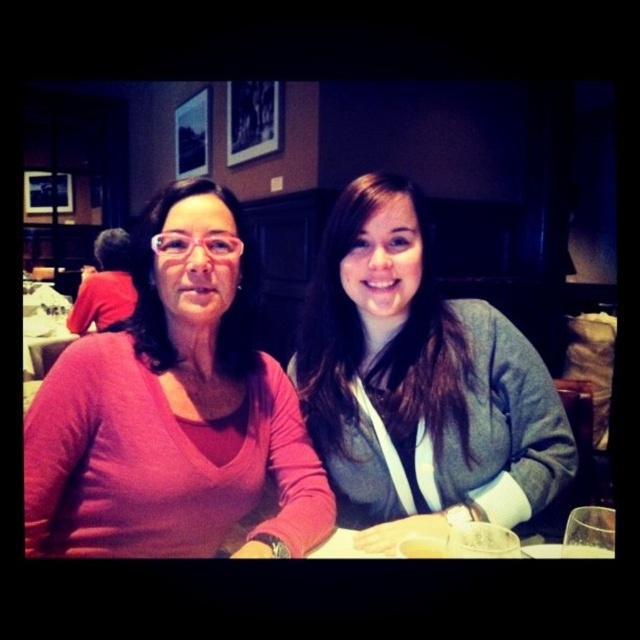
Does gray fleece sweater at center appear on the left side of red shirt at left?

In fact, gray fleece sweater at center is to the right of red shirt at left.

Where is `gray fleece sweater at center`? gray fleece sweater at center is located at coordinates (x=419, y=381).

Does point (390, 532) lie in front of point (120, 268)?

Yes, it is.

Find the location of a particular element. This screenshot has height=640, width=640. gray fleece sweater at center is located at coordinates (419, 381).

Is matte pink sweater at left shorter than gray fleece sweater at center?

Indeed, matte pink sweater at left has a lesser height compared to gray fleece sweater at center.

Where is `matte pink sweater at left`? This screenshot has width=640, height=640. matte pink sweater at left is located at coordinates (173, 410).

The width and height of the screenshot is (640, 640). I want to click on matte pink sweater at left, so click(173, 410).

Between point (186, 232) and point (108, 289), which one is positioned behind?

Point (108, 289)

The image size is (640, 640). What are the coordinates of `matte pink sweater at left` in the screenshot? It's located at (173, 410).

Where is `matte pink sweater at left`? This screenshot has height=640, width=640. matte pink sweater at left is located at coordinates (173, 410).